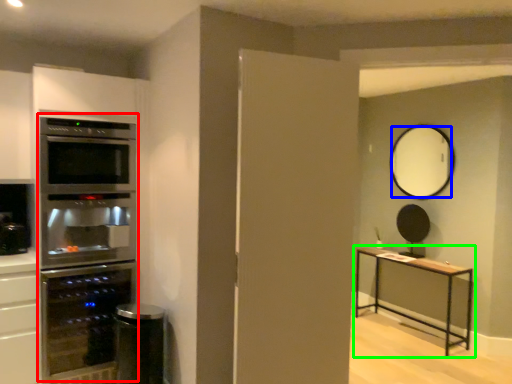
Question: Considering the real-world distances, which object is closest to fridge (highlighted by a red box)? mirror (highlighted by a blue box) or table (highlighted by a green box).

Choices:
 (A) mirror
 (B) table

Answer: (B)